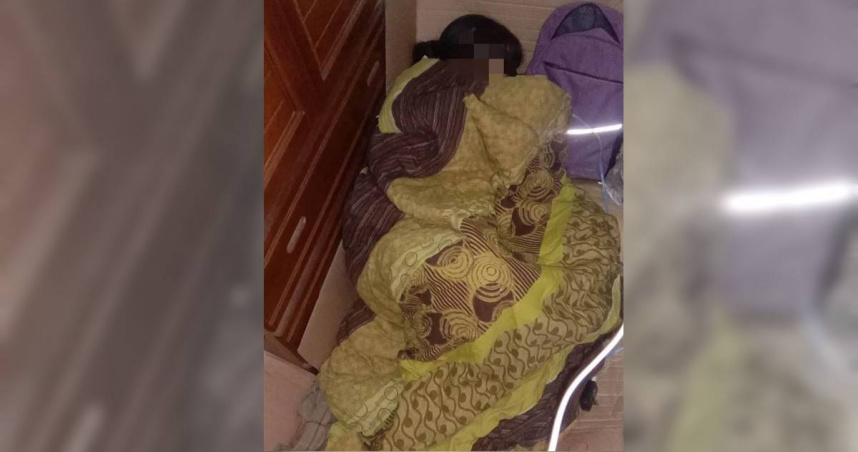
Where is `dresser`? This screenshot has height=452, width=858. dresser is located at coordinates (300, 69).